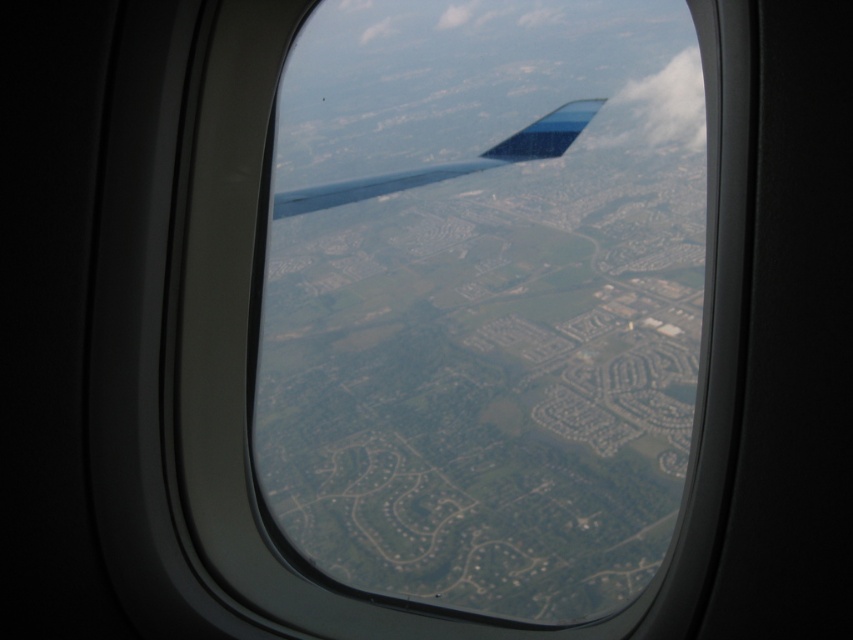
Between point (202, 406) and point (585, 108), which one is positioned in front?

Positioned in front is point (202, 406).

Does transparent glass window at center appear under metallic blue wing at center?

Indeed, transparent glass window at center is positioned under metallic blue wing at center.

Measure the distance between point [227,212] and camera.

Point [227,212] is 9.74 feet from camera.

Find the location of `transparent glass window at center`. transparent glass window at center is located at coordinates (251, 310).

Does white fluffy cloud at upper right have a lesser height compared to metallic blue wing at center?

Yes.

Which is behind, point (668, 76) or point (463, 170)?

Point (668, 76)

Identify the location of white fluffy cloud at upper right. (654, 109).

Looking at this image, who is lower down, transparent glass window at center or white fluffy cloud at upper right?

transparent glass window at center is lower down.

Is transparent glass window at center to the right of white fluffy cloud at upper right from the viewer's perspective?

In fact, transparent glass window at center is to the left of white fluffy cloud at upper right.

Where is `transparent glass window at center`? This screenshot has height=640, width=853. transparent glass window at center is located at coordinates (251, 310).